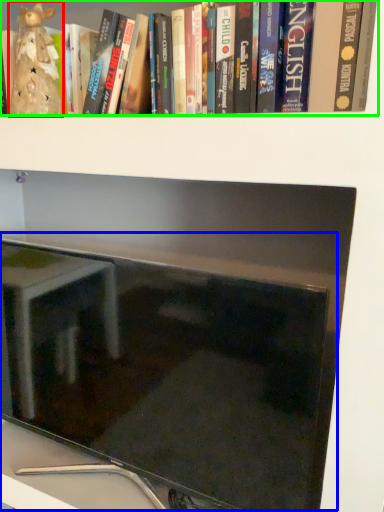
Question: Which object is positioned closest to figurine (highlighted by a red box)? Select from computer monitor (highlighted by a blue box) and book (highlighted by a green box).

Choices:
 (A) computer monitor
 (B) book

Answer: (B)